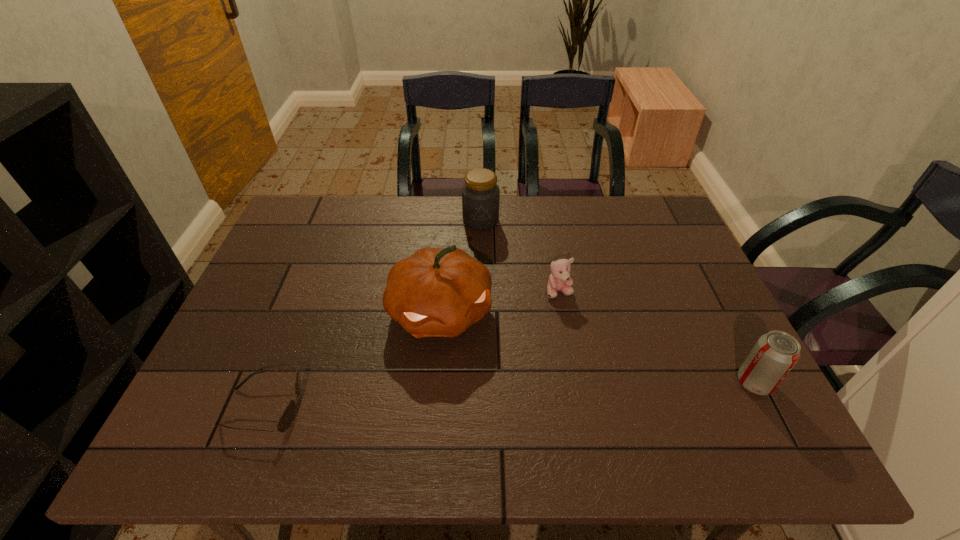
You are a GUI agent. You are given a task and a screenshot of the screen. Output one action in this format:
    pyautogui.click(x=<x>, y=<y>)
    Task: Click on the shortest object
    
    Given the screenshot: What is the action you would take?
    pyautogui.click(x=286, y=419)

Image resolution: width=960 pixels, height=540 pixels. In order to click on sunglasses in this screenshot , I will do `click(286, 419)`.

Identify the location of the third tallest object. This screenshot has height=540, width=960. (773, 356).

Locate an element on the screen. soda can is located at coordinates point(773,356).

Image resolution: width=960 pixels, height=540 pixels. I want to click on pumpkin, so coord(436,292).

Locate an element on the screen. Image resolution: width=960 pixels, height=540 pixels. jar is located at coordinates (480, 194).

Image resolution: width=960 pixels, height=540 pixels. I want to click on the second shortest object, so click(x=559, y=280).

Image resolution: width=960 pixels, height=540 pixels. In order to click on teddy bear in this screenshot , I will do [x=559, y=280].

This screenshot has width=960, height=540. Identify the location of blank space located 0.270m on the front-facing side of the leftmost object. (425, 407).

You are a GUI agent. You are given a task and a screenshot of the screen. Output one action in this format:
    pyautogui.click(x=<x>, y=<y>)
    Task: Click on the vacant space located on the back of the third shortest object
    
    Given the screenshot: What is the action you would take?
    pyautogui.click(x=730, y=334)